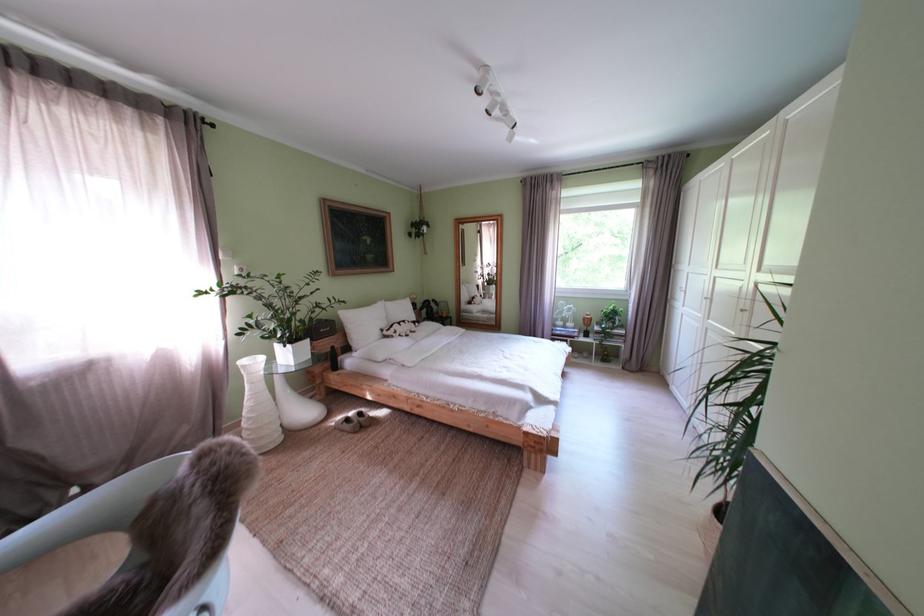
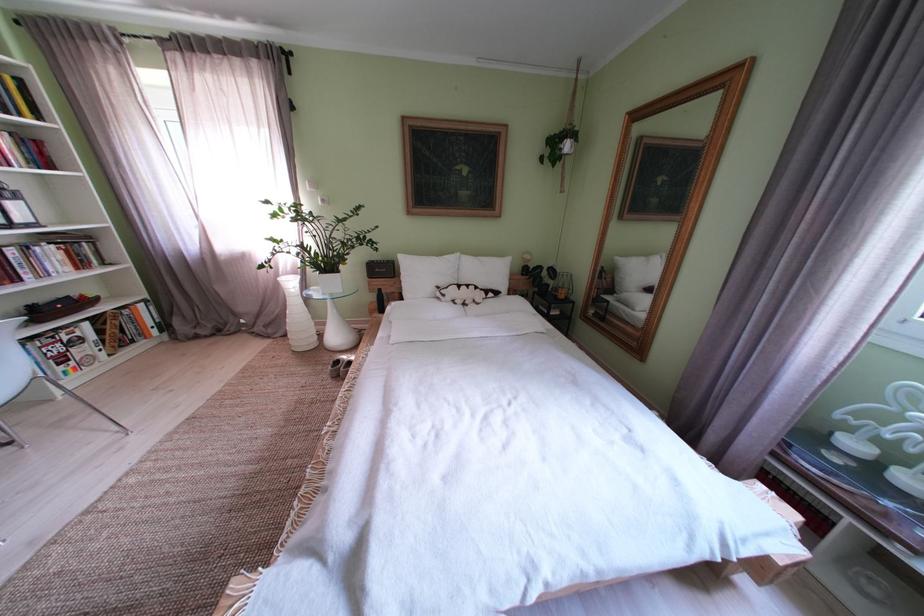
Where in the second image is the point corresponding to [373,330] from the first image?

(429, 280)